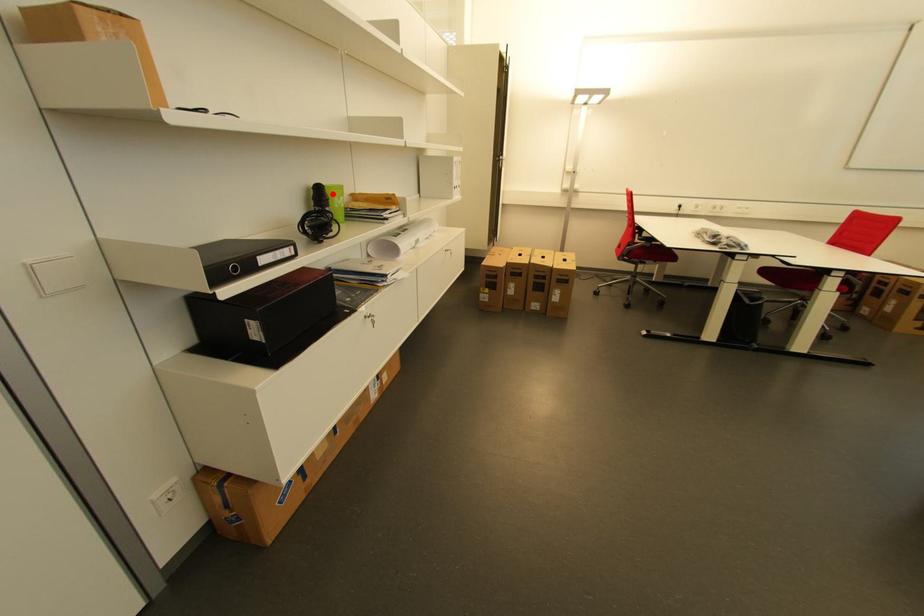
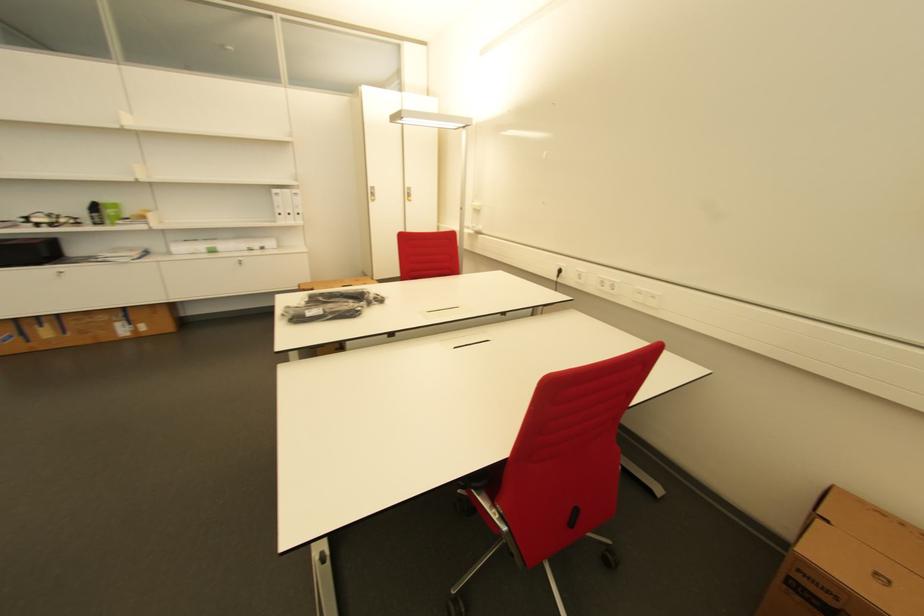
Find the pixel in the second image that matches the highlighted location in the first image.

(104, 208)